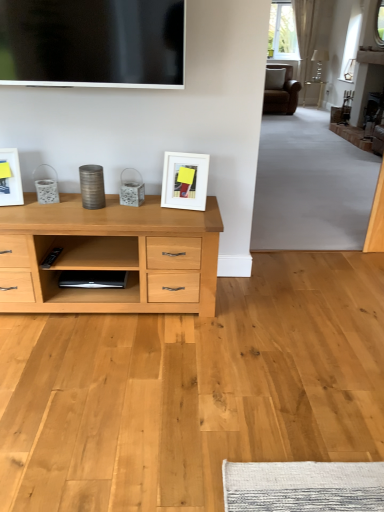
Question: Considering their positions, is flat screen tv at upper center located in front of or behind white glossy picture frame at left, positioned as the second picture frame in right-to-left order?

Choices:
 (A) behind
 (B) front

Answer: (B)

Question: Is flat screen tv at upper center spatially inside white glossy picture frame at left, positioned as the second picture frame in right-to-left order, or outside of it?

Choices:
 (A) inside
 (B) outside

Answer: (B)

Question: Based on their relative distances, which object is nearer to the white matte picture frame at center, acting as the 2th picture frame starting from the left?

Choices:
 (A) flat screen tv at upper center
 (B) white glossy picture frame at left, positioned as the second picture frame in right-to-left order

Answer: (A)

Question: Based on their relative distances, which object is farther from the white glossy picture frame at left, placed as the first picture frame when sorted from left to right?

Choices:
 (A) white matte picture frame at center, the first picture frame in the right-to-left sequence
 (B) flat screen tv at upper center

Answer: (A)